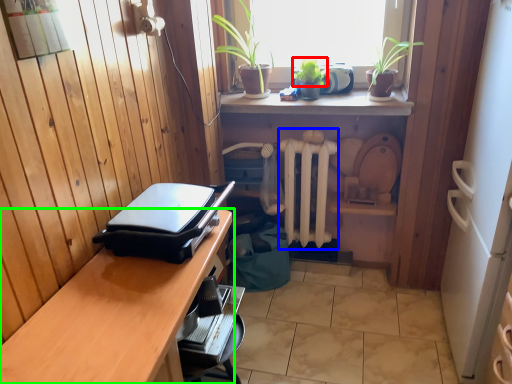
Question: Which object is the farthest from plant (highlighted by a red box)? Choose among these: radiator (highlighted by a blue box) or desk (highlighted by a green box).

Choices:
 (A) radiator
 (B) desk

Answer: (B)